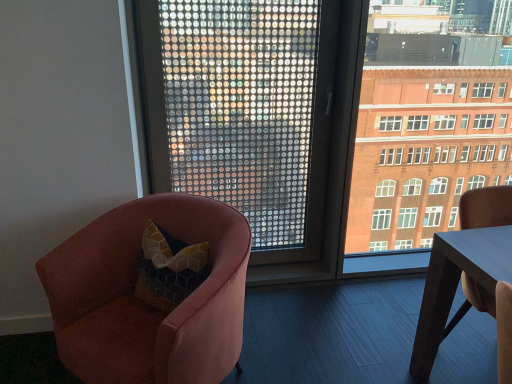
Find the location of a particular element. vacant position to the left of smooth wooden table at right is located at coordinates (384, 342).